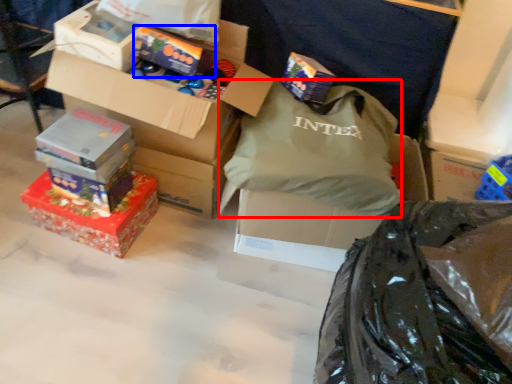
Question: Which of the following is the farthest to the observer, grocery bag (highlighted by a red box) or box (highlighted by a blue box)?

Choices:
 (A) grocery bag
 (B) box

Answer: (B)